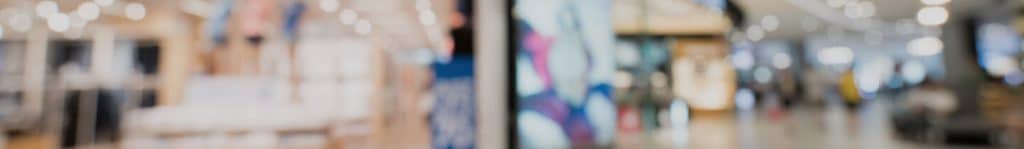
The image size is (1024, 149). I want to click on blurred black windows, so click(74, 50), click(146, 49).